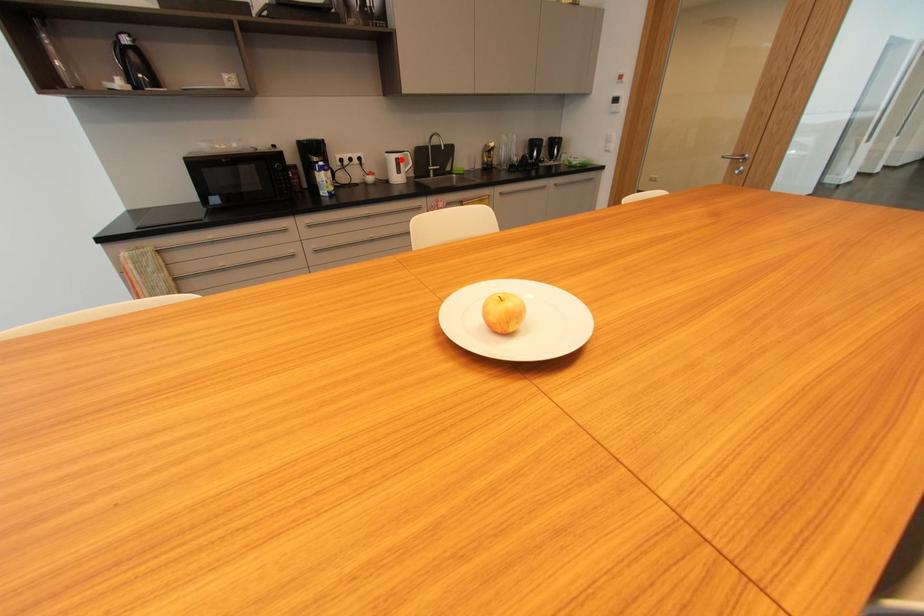
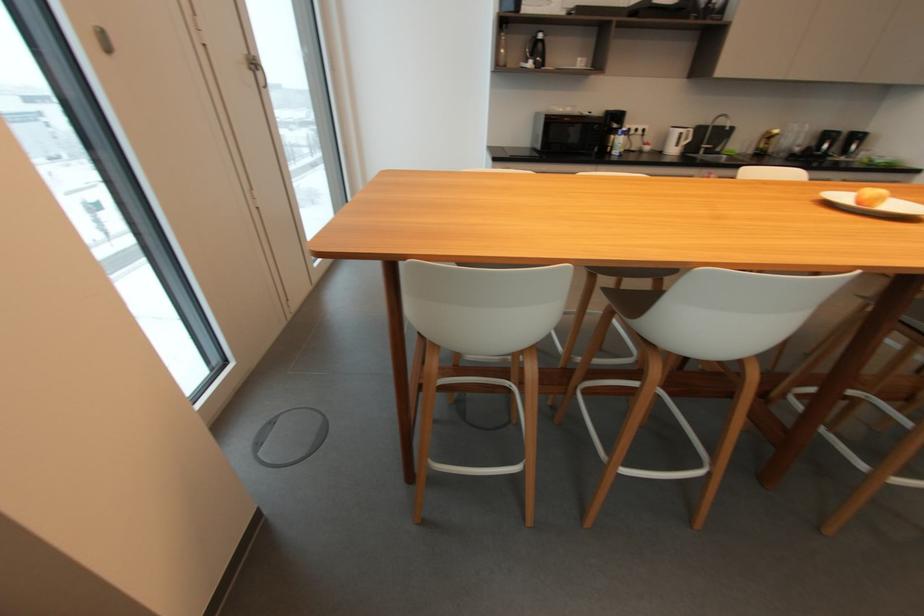
Question: I am providing you with two images of the same scene from different viewpoints. In image1, a red point is highlighted. Considering the same 3D point in image2, which of the following is correct?

Choices:
 (A) It is closer
 (B) It is farther

Answer: (B)